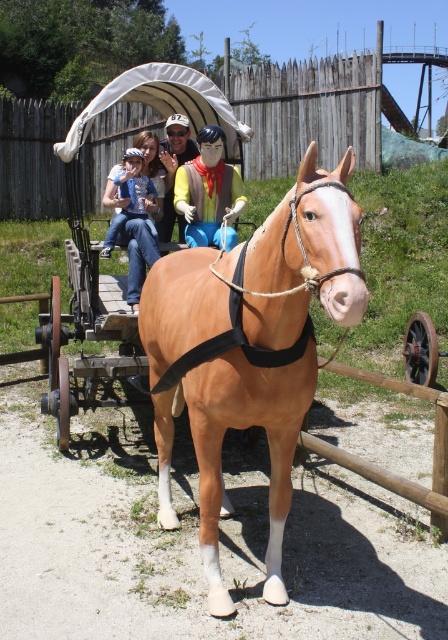
You are standing at the entrance of the historical site and want to locate the brown leather horse cart at center. According to the map coordinates, where should you look?

The brown leather horse cart at center is located at point (99,244).

You are standing at the point marked by the coordinate point (99, 244) in the image. What object are you directly in front of?

The point marked by the coordinate point (99, 244) is directly in front of the brown leather horse cart at center.